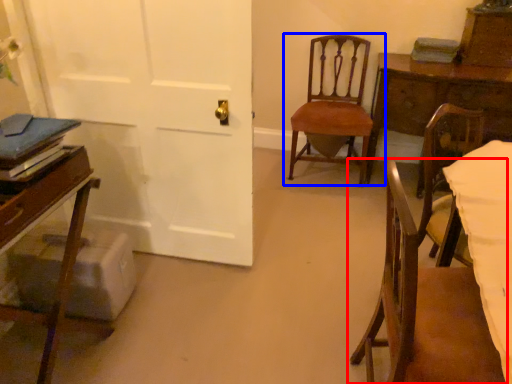
Question: Among these objects, which one is nearest to the camera, chair (highlighted by a red box) or chair (highlighted by a blue box)?

Choices:
 (A) chair
 (B) chair

Answer: (A)